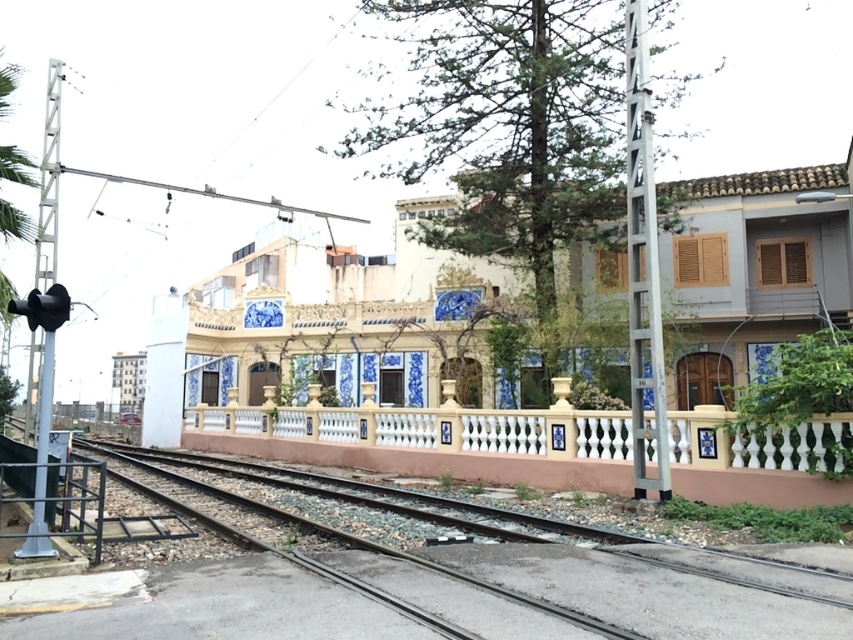
Who is lower down, smooth concrete tracks at center or smooth concrete rail at center?

smooth concrete tracks at center is lower down.

Is smooth concrete tracks at center taller than smooth concrete rail at center?

In fact, smooth concrete tracks at center may be shorter than smooth concrete rail at center.

This screenshot has height=640, width=853. In order to click on smooth concrete tracks at center in this screenshot , I will do [x=410, y=577].